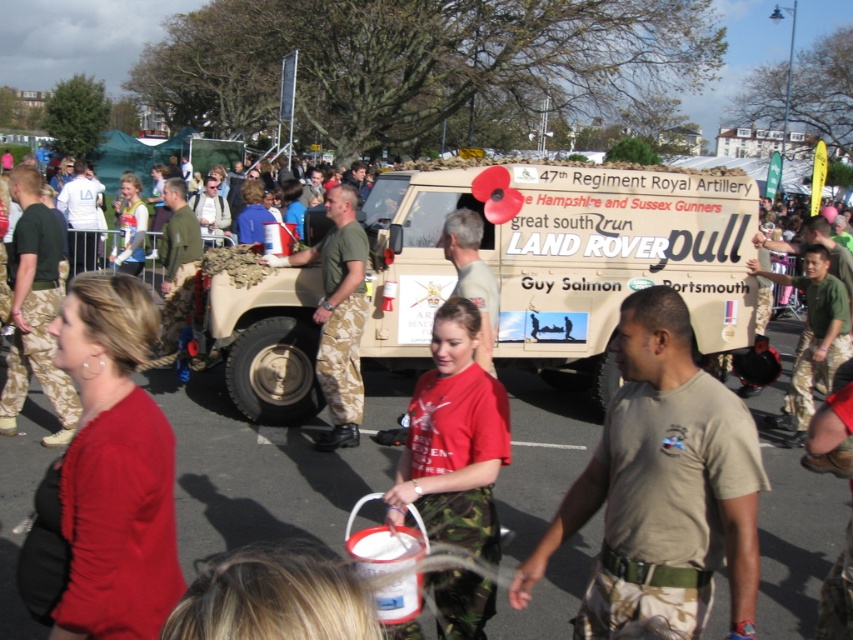
Question: Can you confirm if tan matte land rover at center is thinner than camo-patterned pants at center?

Choices:
 (A) yes
 (B) no

Answer: (B)

Question: Where is camouflage uniform at center located in relation to camo-patterned pants at center in the image?

Choices:
 (A) above
 (B) below

Answer: (B)

Question: Observing the image, what is the correct spatial positioning of tan matte land rover at center in reference to camo-patterned pants at center?

Choices:
 (A) right
 (B) left

Answer: (A)

Question: Estimate the real-world distances between objects in this image. Which object is closer to the camouflage uniform at center?

Choices:
 (A) tan matte land rover at center
 (B) camo-patterned pants at center

Answer: (B)

Question: Among these points, which one is farthest from the camera?

Choices:
 (A) (668, 324)
 (B) (320, 396)

Answer: (B)

Question: Which object is farther from the camera taking this photo?

Choices:
 (A) tan matte land rover at center
 (B) camo-patterned pants at center
 (C) camouflage uniform at center

Answer: (A)